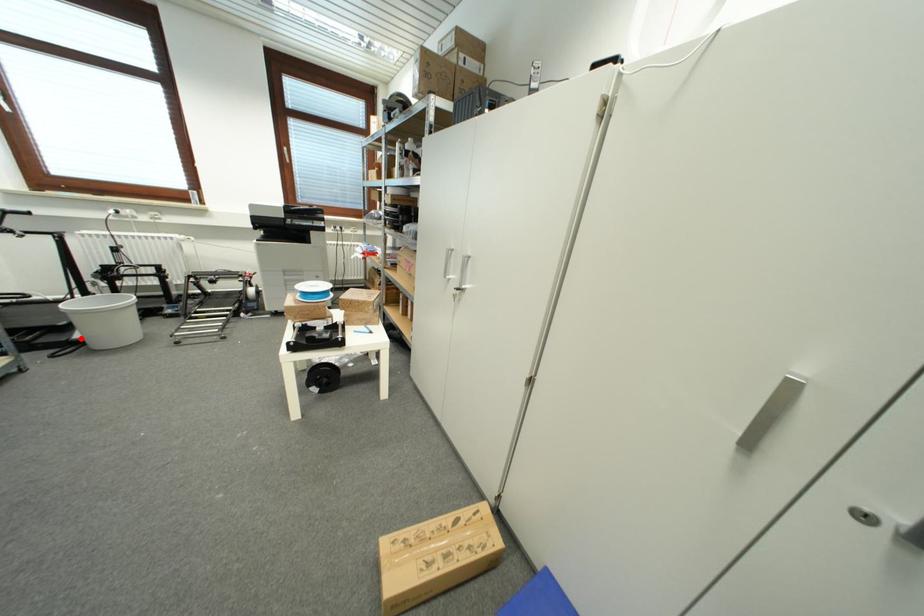
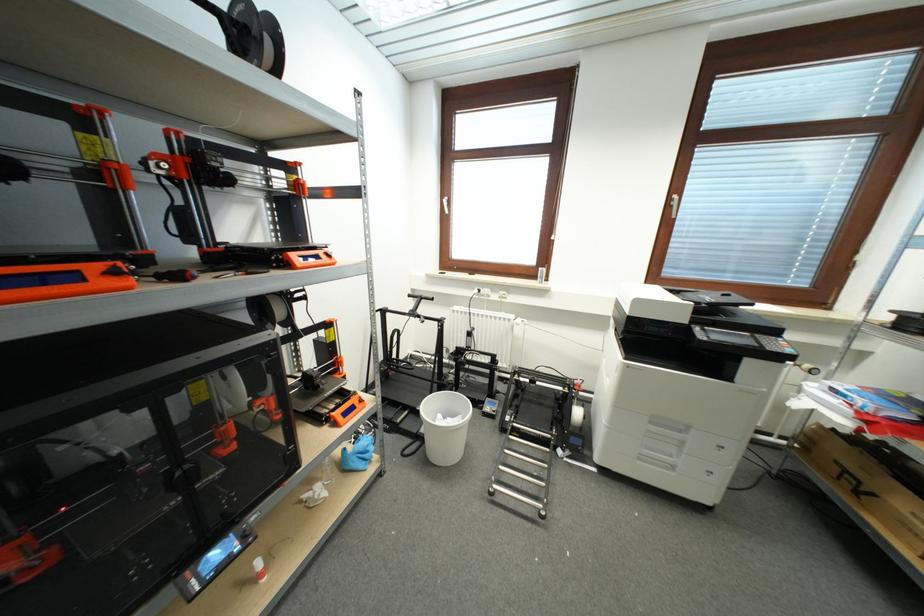
Locate, in the second image, the point that corresponds to the highlighted location in the first image.

(427, 434)